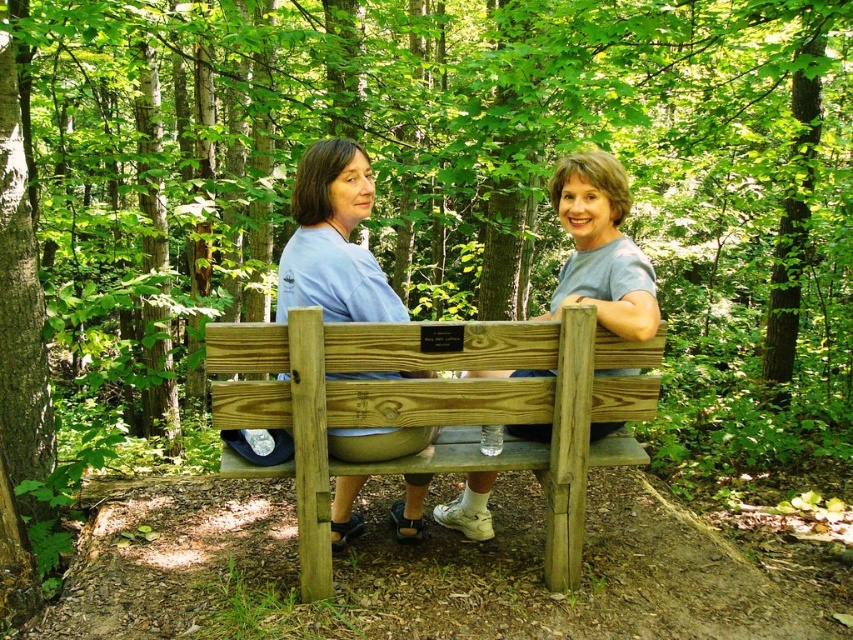
You are standing in the forest and see the wooden bench at center and the gray matte wood bench at center. Which bench is closer to the ground?

The wooden bench at center is closer to the ground because it is positioned below the gray matte wood bench at center.

You are planning to place a small potted plant between the wooden bench at center and the matte blue shirt at center. Based on their sizes, which object should the plant be closer to?

The wooden bench at center occupies less space than the matte blue shirt at center, so the plant should be placed closer to the wooden bench at center to maintain balance between their sizes.

You are a photographer positioned to the left of the scene. You want to capture a photo of the matte blue shirt at center without including the gray matte wood bench at center in the frame. Which direction should you move to achieve this?

The matte blue shirt at center is to the left of the gray matte wood bench at center. To avoid including the bench in the frame while focusing on the shirt, move further to the left side of the scene.